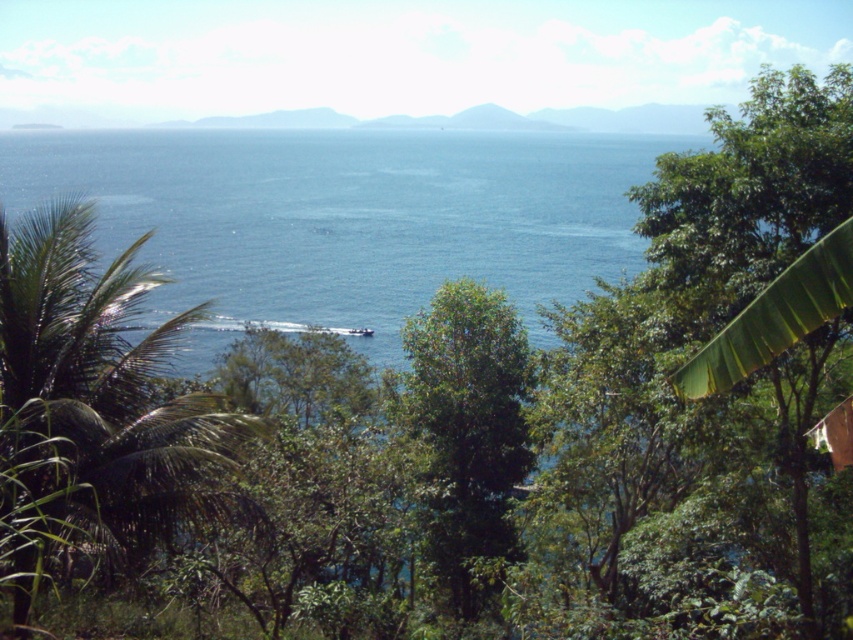
Question: Does green leafy palm tree at center-left have a larger size compared to green leafy tree at center?

Choices:
 (A) yes
 (B) no

Answer: (A)

Question: Does green leafy palm tree at center-left lie behind green leafy tree at center?

Choices:
 (A) yes
 (B) no

Answer: (B)

Question: Which of the following is the farthest from the observer?

Choices:
 (A) (447, 301)
 (B) (42, 269)

Answer: (A)

Question: Among these objects, which one is nearest to the camera?

Choices:
 (A) green leafy tree at center
 (B) green leafy palm tree at center-left

Answer: (B)

Question: Among these objects, which one is nearest to the camera?

Choices:
 (A) green leafy tree at center
 (B) green leafy palm tree at center-left

Answer: (B)

Question: In this image, where is green leafy palm tree at center-left located relative to green leafy tree at center?

Choices:
 (A) right
 (B) left

Answer: (B)